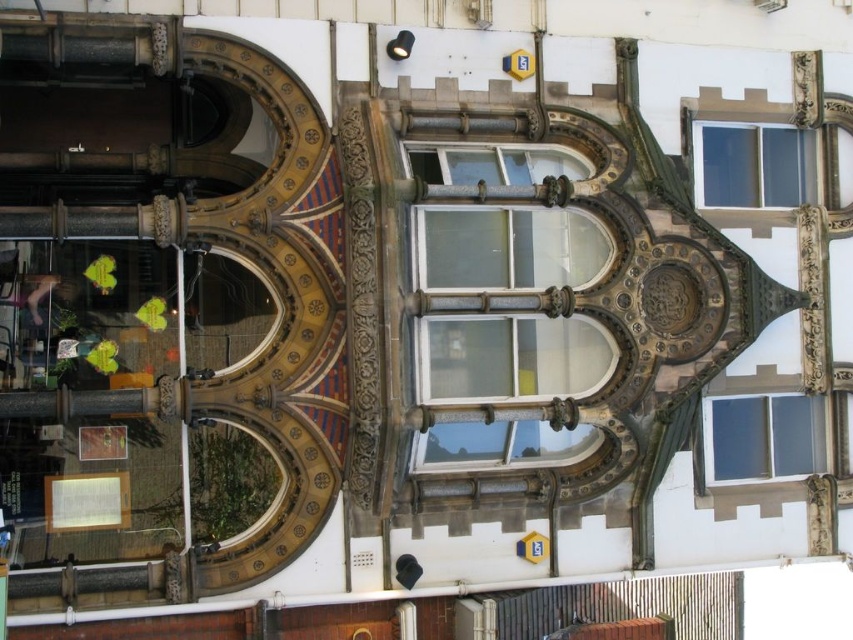
You are an architect assessing the building facade. You need to install a decorative trim around both the clear glass window at center and the clear glass window at upper center. Which window requires a taller trim based on their sizes?

The clear glass window at center requires a taller trim since it is taller than the clear glass window at upper center.

You are standing in front of the building and want to locate the clear glass window at center. According to the coordinates provided, where would you find it?

The clear glass window at center is located at point coordinates (506, 246).

You are standing in front of the building and want to look at the clear glass window at upper center. Which direction should you look relative to the clear glass window at upper right?

The clear glass window at upper center is located above the clear glass window at upper right, so you should look upward from the clear glass window at upper right to see the clear glass window at upper center.